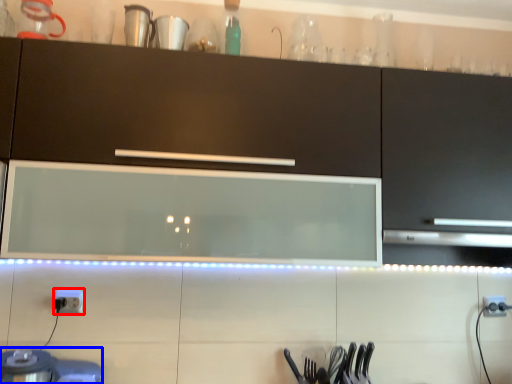
Question: Among these objects, which one is farthest to the camera, electric outlet (highlighted by a red box) or appliance (highlighted by a blue box)?

Choices:
 (A) electric outlet
 (B) appliance

Answer: (A)